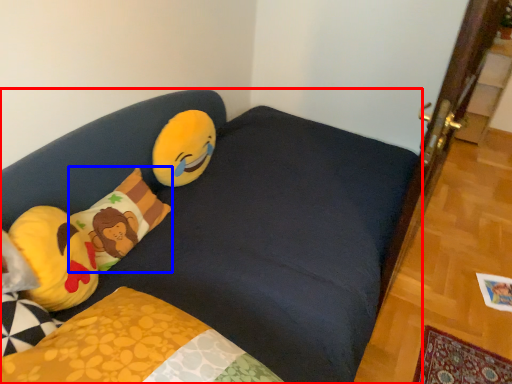
Question: Which object appears farthest to the camera in this image, studio couch (highlighted by a red box) or pillow (highlighted by a blue box)?

Choices:
 (A) studio couch
 (B) pillow

Answer: (B)